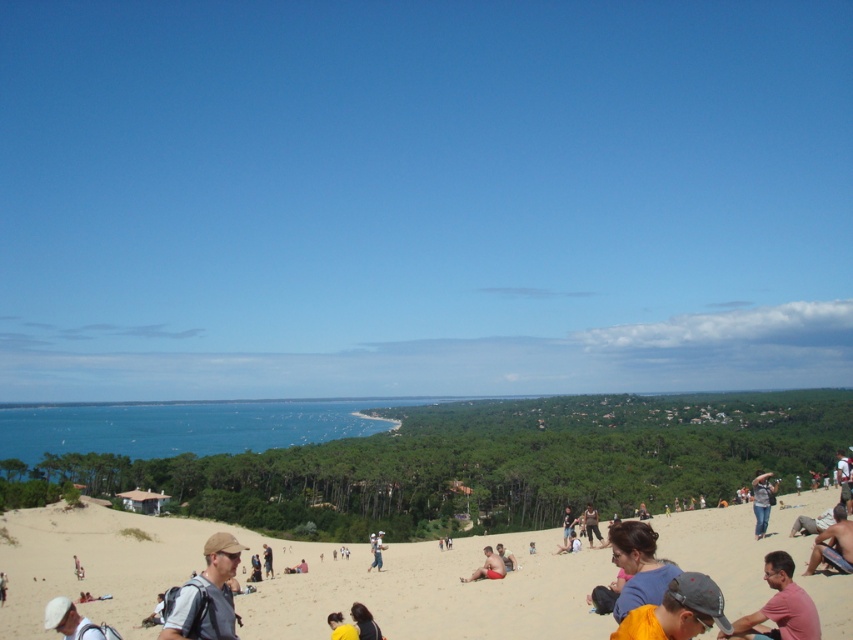
You are a photographer trying to capture a candid shot of the pink cotton shirt at lower right and the light blue denim shorts at center. Since you want to focus on the shirt, should you adjust your camera to focus on the foreground or background?

The pink cotton shirt at lower right is positioned over light blue denim shorts at center, so to focus on the shirt, you should adjust your camera to focus on the foreground.

You are a photographer trying to capture a photo of the yellow fabric cap at lower right and the light blue denim shorts at center. Since you want both subjects to be in focus, you need to know which one is closer to you. Can you determine which is closer?

The yellow fabric cap at lower right is shorter than the light blue denim shorts at center, so the yellow fabric cap at lower right is closer to you.